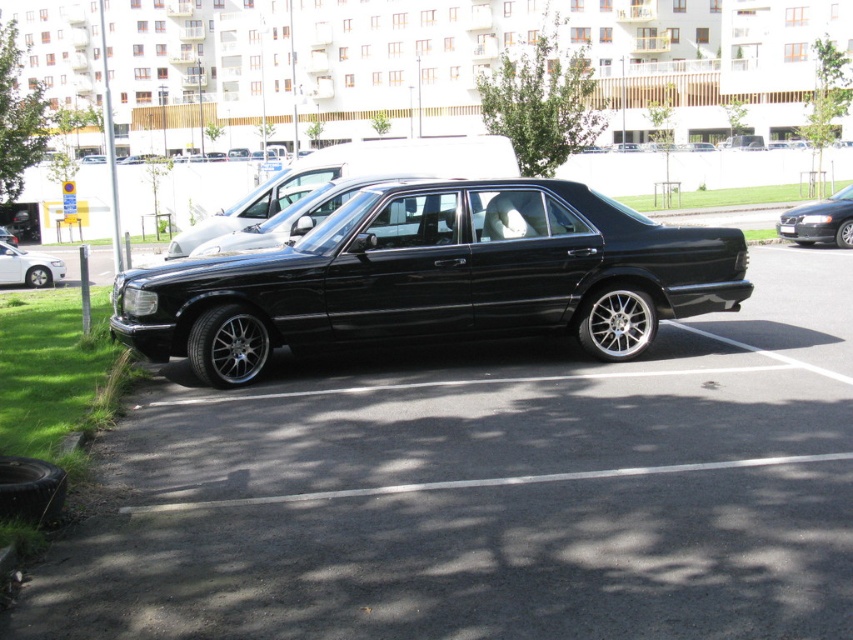
Question: Is black metallic sedan at center positioned in front of black metallic sedan at right?

Choices:
 (A) yes
 (B) no

Answer: (A)

Question: Which object is the closest to the black metallic sedan at center?

Choices:
 (A) black metallic sedan at right
 (B) black car at center
 (C) black polished sedan at center
 (D) matte black sedan at left

Answer: (C)

Question: Does black metallic sedan at right have a lesser width compared to matte black sedan at left?

Choices:
 (A) yes
 (B) no

Answer: (B)

Question: In this image, where is black polished sedan at center located relative to black metallic sedan at right?

Choices:
 (A) right
 (B) left

Answer: (B)

Question: Which object is the farthest from the black polished sedan at center?

Choices:
 (A) black car at center
 (B) black metallic sedan at center

Answer: (B)

Question: Which object is the closest to the black metallic sedan at center?

Choices:
 (A) black metallic sedan at right
 (B) matte black sedan at left

Answer: (A)